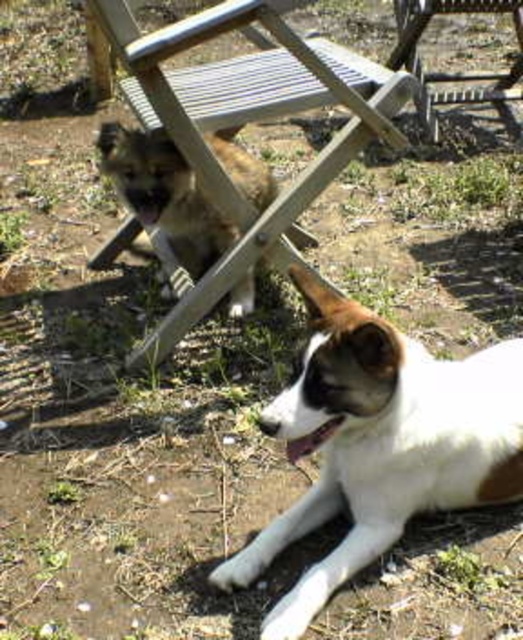
You are planning to set up a tent in this outdoor area. The tent requires at least 1 meter of clearance from any objects. Considering the white fur dog at lower right and the metallic silver beach chair at upper right, which object is closer to the tent site if the tent is placed between them?

The white fur dog at lower right is closer to the tent site because it is not as tall as the metallic silver beach chair at upper right, so it would be within the 1 meter clearance requirement.

Consider the image. What is located at the point with coordinates (247, 118) in the image?

The point at coordinates (247, 118) indicates the location of the wooden chair in the image.

You are standing in the outdoor scene and want to walk from the white dog with brown patches lying on the ground to the wooden chair. Which point, point (188, 97) or point (186, 180), is closer to you as you move towards the chair?

Point (188, 97) is closer to you because it is further to the viewer than point (186, 180), meaning it is nearer to your current position as you move towards the wooden chair.